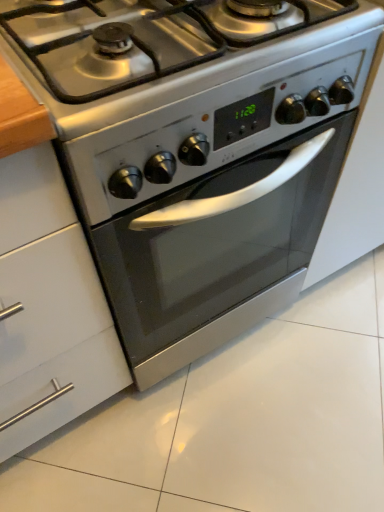
Question: Does white glossy cabinet at left turn towards satin silver gas stove at center?

Choices:
 (A) yes
 (B) no

Answer: (B)

Question: Is white glossy cabinet at left further to camera compared to satin silver gas stove at center?

Choices:
 (A) no
 (B) yes

Answer: (A)

Question: Is white glossy cabinet at left looking in the opposite direction of satin silver gas stove at center?

Choices:
 (A) no
 (B) yes

Answer: (A)

Question: Does white glossy cabinet at left have a greater width compared to satin silver gas stove at center?

Choices:
 (A) no
 (B) yes

Answer: (B)

Question: From a real-world perspective, does white glossy cabinet at left sit lower than satin silver gas stove at center?

Choices:
 (A) no
 (B) yes

Answer: (B)

Question: Does white glossy cabinet at left have a lesser width compared to satin silver gas stove at center?

Choices:
 (A) yes
 (B) no

Answer: (B)

Question: From the image's perspective, is satin silver gas stove at center located above white glossy cabinet at left?

Choices:
 (A) yes
 (B) no

Answer: (A)

Question: From the image's perspective, is satin silver gas stove at center below white glossy cabinet at left?

Choices:
 (A) no
 (B) yes

Answer: (A)

Question: Is satin silver gas stove at center to the left of white glossy cabinet at left from the viewer's perspective?

Choices:
 (A) yes
 (B) no

Answer: (B)

Question: From a real-world perspective, does satin silver gas stove at center stand above white glossy cabinet at left?

Choices:
 (A) no
 (B) yes

Answer: (B)

Question: Can you confirm if satin silver gas stove at center is taller than white glossy cabinet at left?

Choices:
 (A) yes
 (B) no

Answer: (B)

Question: Is satin silver gas stove at center further to camera compared to white glossy cabinet at left?

Choices:
 (A) yes
 (B) no

Answer: (A)

Question: Considering the positions of satin silver gas stove at center and white glossy cabinet at left in the image, is satin silver gas stove at center wider or thinner than white glossy cabinet at left?

Choices:
 (A) thin
 (B) wide

Answer: (A)